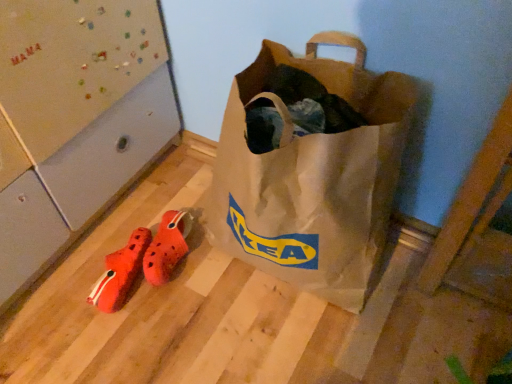
The image size is (512, 384). Find the location of `free region on the left part of orange fabric shoe at lower left`. free region on the left part of orange fabric shoe at lower left is located at coordinates (60, 291).